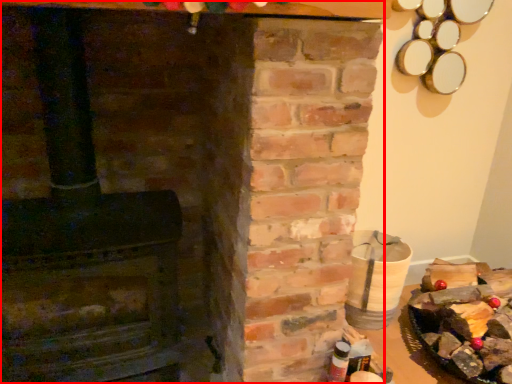
Question: From the image's perspective, considering the relative positions of fireplace (annotated by the red box) and food in the image provided, where is fireplace (annotated by the red box) located with respect to the staircase?

Choices:
 (A) above
 (B) below

Answer: (A)